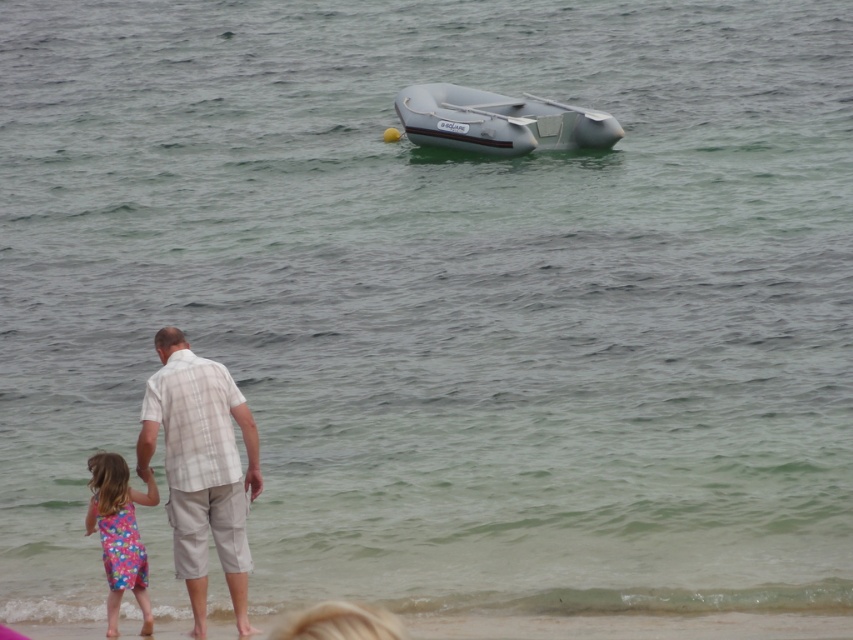
Question: Does white plaid shirt at center have a lesser width compared to silver rubber boat at upper center?

Choices:
 (A) no
 (B) yes

Answer: (B)

Question: Among these points, which one is farthest from the camera?

Choices:
 (A) tap(445, 90)
 (B) tap(103, 520)

Answer: (A)

Question: Estimate the real-world distances between objects in this image. Which object is farther from the floral fabric dress at lower left?

Choices:
 (A) white plaid shirt at center
 (B) silver rubber boat at upper center

Answer: (B)

Question: Does silver rubber boat at upper center have a smaller size compared to floral fabric dress at lower left?

Choices:
 (A) no
 (B) yes

Answer: (A)

Question: Is silver rubber boat at upper center positioned at the back of floral fabric dress at lower left?

Choices:
 (A) yes
 (B) no

Answer: (A)

Question: Estimate the real-world distances between objects in this image. Which object is closer to the silver rubber boat at upper center?

Choices:
 (A) floral fabric dress at lower left
 (B) white plaid shirt at center

Answer: (B)